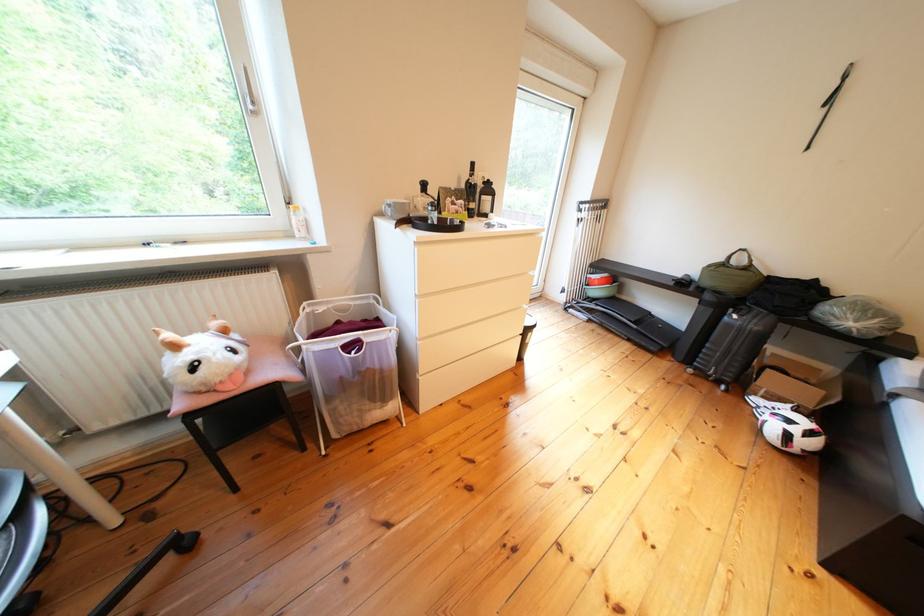
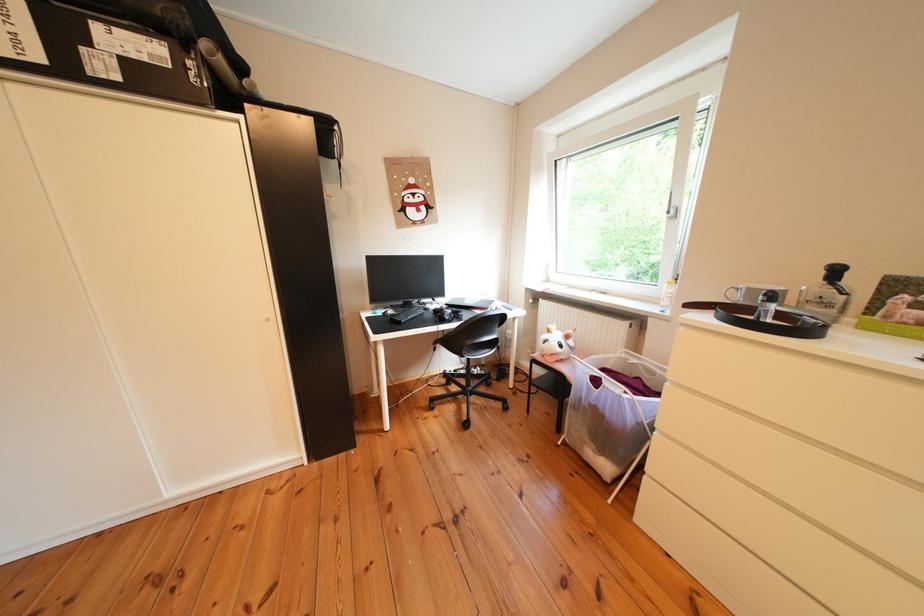
The point at (381, 410) is marked in the first image. Where is the corresponding point in the second image?

(601, 442)